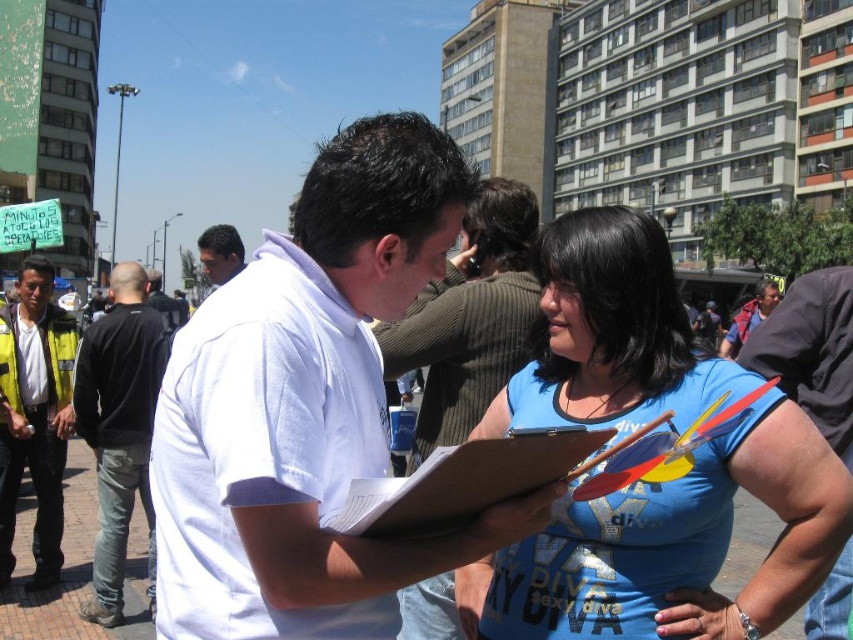
Question: Which point appears farthest from the camera in this image?

Choices:
 (A) (119, 609)
 (B) (735, 344)
 (C) (566, 435)
 (D) (293, 248)

Answer: (B)

Question: Which point is farther to the camera?

Choices:
 (A) blue denim jacket at center
 (B) black cotton shirt at left

Answer: (A)

Question: Is black cotton shirt at left above brown cardboard clipboard at center?

Choices:
 (A) no
 (B) yes

Answer: (B)

Question: Is the position of yellow reflective vest at left less distant than that of brown cardboard clipboard at center?

Choices:
 (A) no
 (B) yes

Answer: (A)

Question: Does blue cotton shirt at center have a greater width compared to black cotton shirt at left?

Choices:
 (A) yes
 (B) no

Answer: (B)

Question: Among these points, which one is farthest from the camera?

Choices:
 (A) (368, 486)
 (B) (215, 241)
 (C) (50, 266)

Answer: (B)